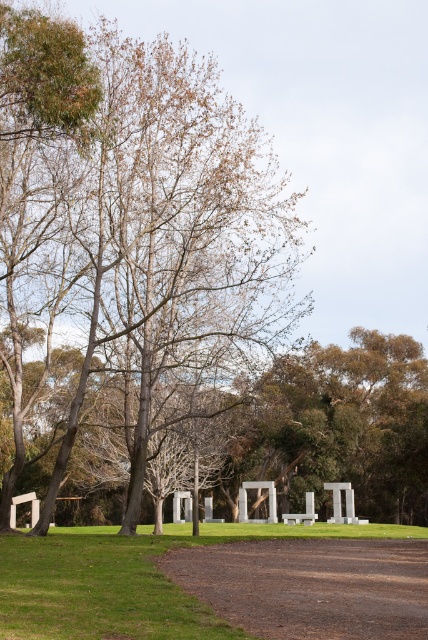
Is brown leafy tree at center below brown dirt path at lower center?

No.

Which is more to the left, brown leafy tree at center or brown dirt path at lower center?

Positioned to the left is brown leafy tree at center.

Is point (62, 141) positioned before point (368, 632)?

No.

The image size is (428, 640). I want to click on brown leafy tree at center, so click(x=130, y=237).